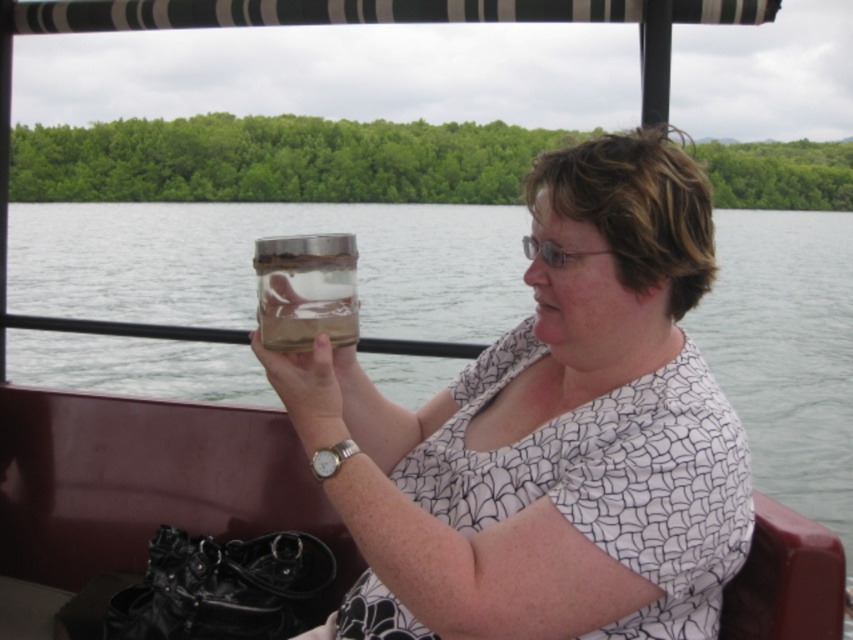
At what (x,y) coordinates should I click in order to perform the action: click on clear glass jar at upper center. Please return your answer as a coordinate pair (x, y). This screenshot has height=640, width=853. Looking at the image, I should click on (550, 433).

Can you confirm if clear glass jar at upper center is taller than transparent glass jar at center?

Yes, clear glass jar at upper center is taller than transparent glass jar at center.

Where is `clear glass jar at upper center`? clear glass jar at upper center is located at coordinates (550, 433).